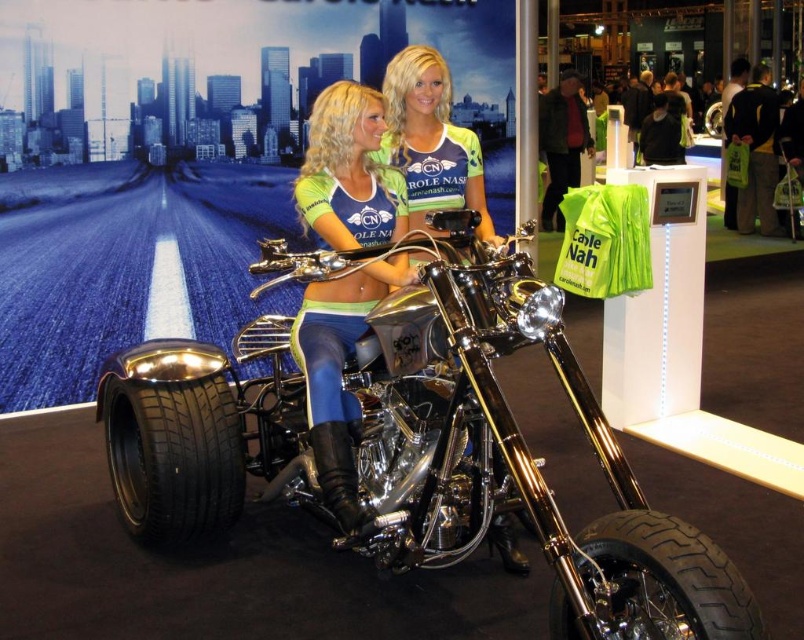
Question: Can you confirm if chrome/metallic trike at center is positioned to the left of black rubber tire at lower left?

Choices:
 (A) no
 (B) yes

Answer: (A)

Question: Estimate the real-world distances between objects in this image. Which object is farther from the black rubber tire at lower left?

Choices:
 (A) shiny metallic tank top at center
 (B) matte green jersey at center

Answer: (A)

Question: Which point appears closest to the camera in this image?

Choices:
 (A) (170, 524)
 (B) (347, 460)

Answer: (B)

Question: Estimate the real-world distances between objects in this image. Which object is closer to the matte green jersey at center?

Choices:
 (A) black rubber tire at lower left
 (B) shiny metallic tank top at center
 (C) black rubber tire at lower right
 (D) chrome/metallic trike at center

Answer: (D)

Question: Can you confirm if chrome/metallic trike at center is bigger than black rubber tire at lower right?

Choices:
 (A) no
 (B) yes

Answer: (B)

Question: Does chrome/metallic trike at center appear over black rubber tire at lower right?

Choices:
 (A) yes
 (B) no

Answer: (A)